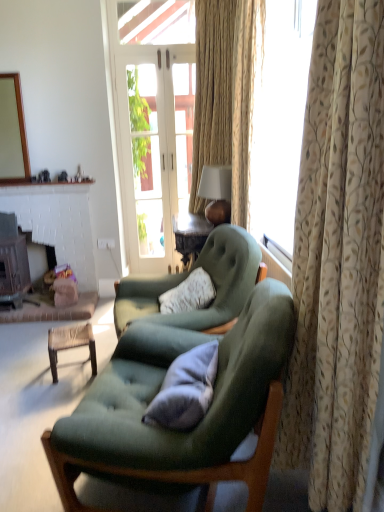
Question: Is gray fabric pillow at center further to camera compared to white plastic power outlet at lower center?

Choices:
 (A) no
 (B) yes

Answer: (A)

Question: Could you tell me if gray fabric pillow at center is turned towards white plastic power outlet at lower center?

Choices:
 (A) yes
 (B) no

Answer: (B)

Question: From a real-world perspective, does gray fabric pillow at center stand above white plastic power outlet at lower center?

Choices:
 (A) yes
 (B) no

Answer: (B)

Question: Considering the relative positions of gray fabric pillow at center and white plastic power outlet at lower center in the image provided, is gray fabric pillow at center to the left of white plastic power outlet at lower center from the viewer's perspective?

Choices:
 (A) yes
 (B) no

Answer: (B)

Question: Is gray fabric pillow at center not near white plastic power outlet at lower center?

Choices:
 (A) yes
 (B) no

Answer: (A)

Question: Is gray fabric pillow at center closer to the viewer compared to white plastic power outlet at lower center?

Choices:
 (A) yes
 (B) no

Answer: (A)

Question: Considering the relative positions of beige textured curtain at right, the first curtain in the back-to-front sequence, and dark brown wood fireplace at left, the 1th fireplace from the left, in the image provided, is beige textured curtain at right, the first curtain in the back-to-front sequence, behind dark brown wood fireplace at left, the 1th fireplace from the left,?

Choices:
 (A) no
 (B) yes

Answer: (A)

Question: Can you confirm if beige textured curtain at right, the first curtain in the back-to-front sequence, is smaller than dark brown wood fireplace at left, the 2th fireplace viewed from the right?

Choices:
 (A) no
 (B) yes

Answer: (A)

Question: Is beige textured curtain at right, the first curtain in the back-to-front sequence, aimed at dark brown wood fireplace at left, the 2th fireplace viewed from the right?

Choices:
 (A) yes
 (B) no

Answer: (B)

Question: Can you confirm if beige textured curtain at right, the first curtain in the back-to-front sequence, is positioned to the left of dark brown wood fireplace at left, the 2th fireplace viewed from the right?

Choices:
 (A) no
 (B) yes

Answer: (A)

Question: From the image's perspective, is beige textured curtain at right, the first curtain in the back-to-front sequence, beneath dark brown wood fireplace at left, the 2th fireplace viewed from the right?

Choices:
 (A) no
 (B) yes

Answer: (A)

Question: Can you confirm if beige textured curtain at right, the first curtain in the back-to-front sequence, is taller than dark brown wood fireplace at left, the 1th fireplace from the left?

Choices:
 (A) yes
 (B) no

Answer: (A)

Question: Is the depth of dark brown wood fireplace at left, the 1th fireplace from the left, less than that of woven brown stool at lower left?

Choices:
 (A) no
 (B) yes

Answer: (A)